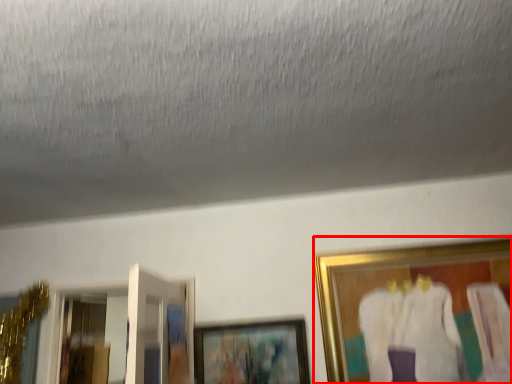
Question: In this image, where is picture frame (annotated by the red box) located relative to picture frame?

Choices:
 (A) left
 (B) right

Answer: (B)